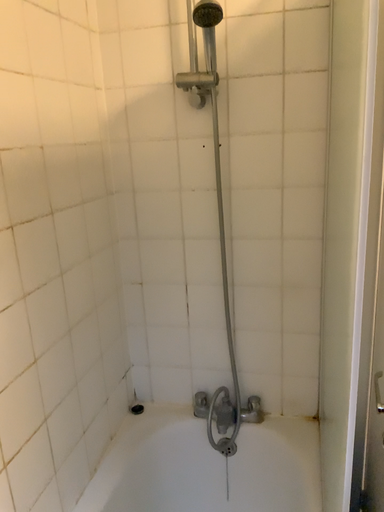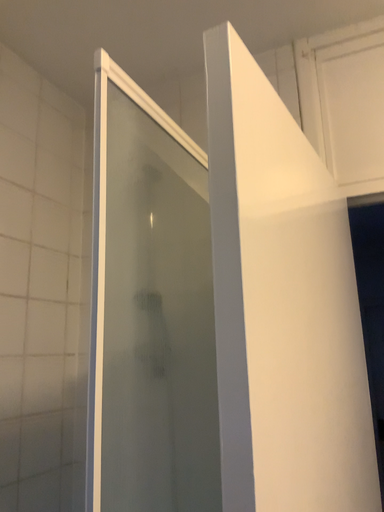
Question: Which way did the camera rotate in the video?

Choices:
 (A) rotated left
 (B) rotated right

Answer: (A)